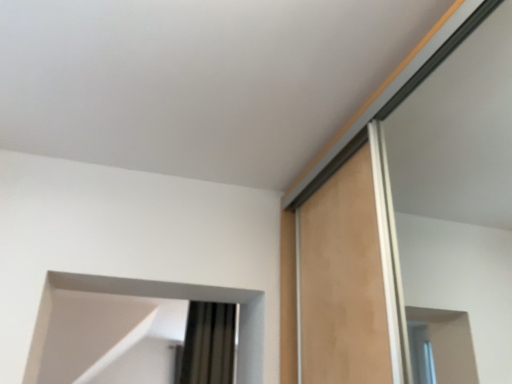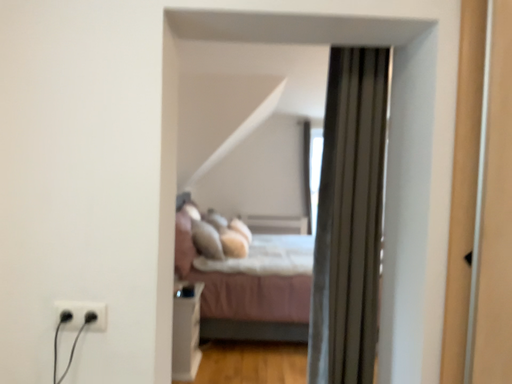
Question: How did the camera likely rotate when shooting the video?

Choices:
 (A) rotated downward
 (B) rotated upward

Answer: (A)